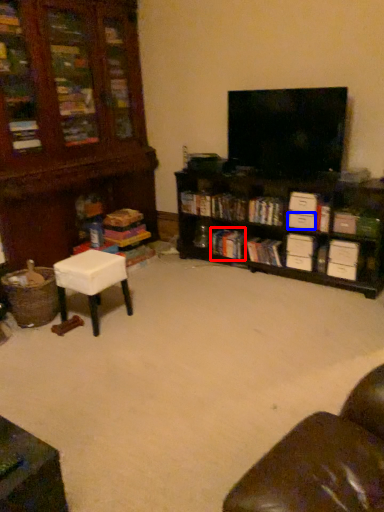
Question: Which object appears farthest to the camera in this image, book (highlighted by a red box) or drawer (highlighted by a blue box)?

Choices:
 (A) book
 (B) drawer

Answer: (A)